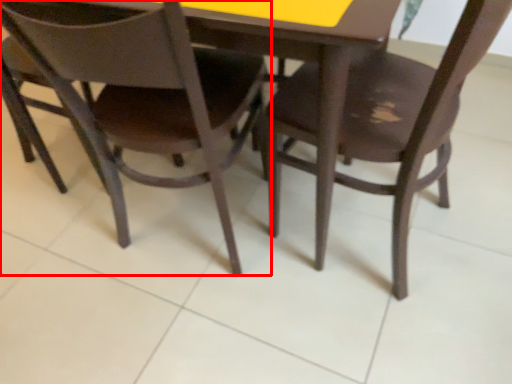
Question: Where is chair (annotated by the red box) located in relation to chair in the image?

Choices:
 (A) right
 (B) left

Answer: (B)